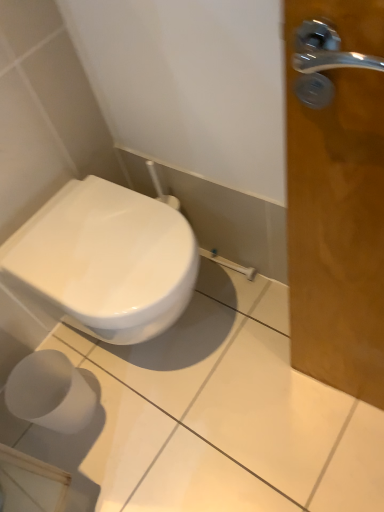
Where is `free spot in front of white matte toilet paper at lower left`? This screenshot has height=512, width=384. free spot in front of white matte toilet paper at lower left is located at coordinates (88, 470).